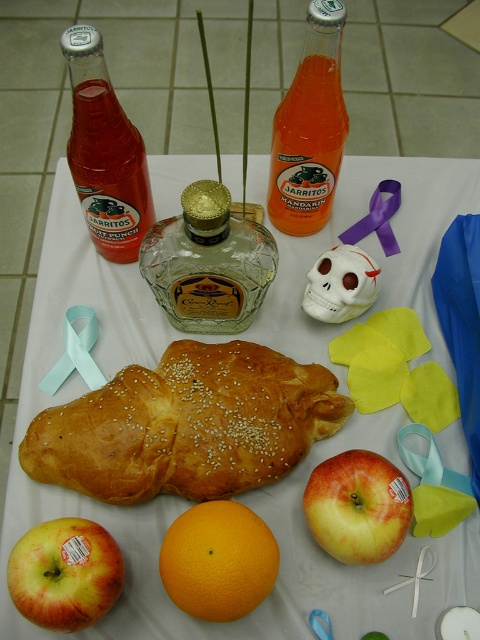
You are standing in front of the table and want to reach for an object. If you focus on the point at coordinates point [266,234] and point [298,160], which point will require you to reach further forward?

Point [298,160] is further away from the camera, so you will need to reach further forward to touch it compared to point [266,234].

You are arranging items on a table for a party. You have a translucent glass bottle at upper left and an orangesmoothorange at center. Which item is closer to the left edge of the table?

The translucent glass bottle at upper left is closer to the left edge of the table because it is positioned on the left side of orangesmoothorange at center.

You are arranging a centerpiece for a dinner party and need to place the red matte apple at center and the purple satin ribbon at center on the table. Based on the image, which item is positioned higher up?

The purple satin ribbon at center is positioned higher up than the red matte apple at center, as the red matte apple at center is located below it.